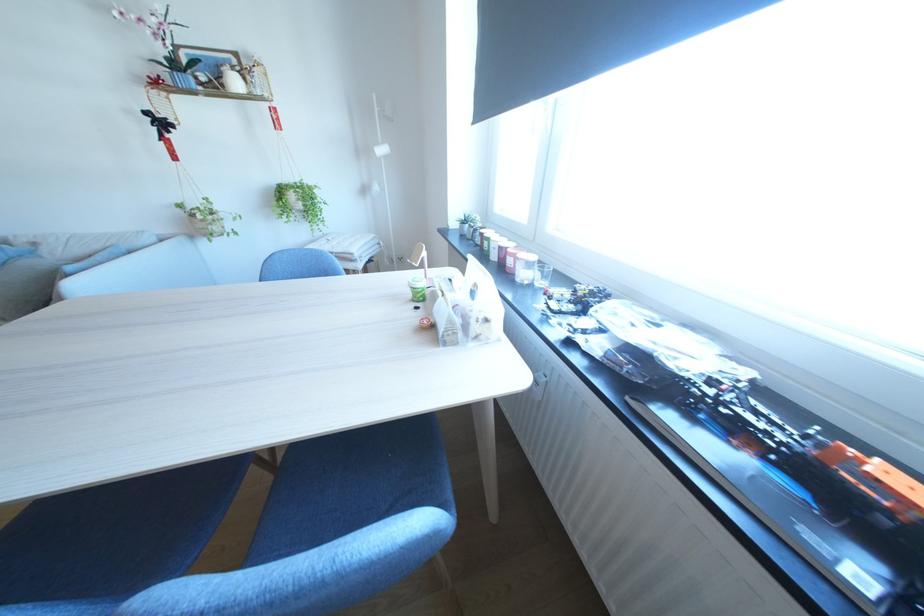
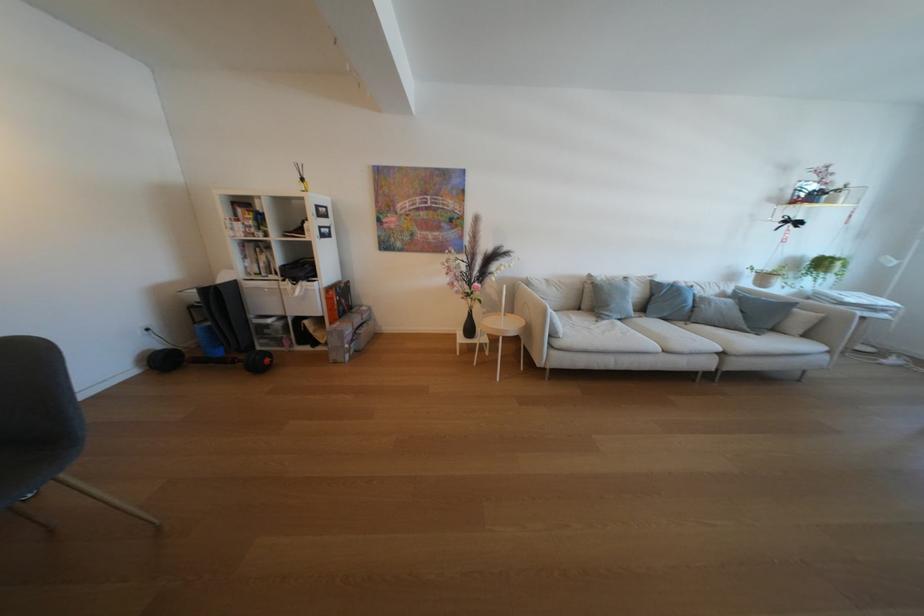
Find the pixel in the second image that matches [117,243] in the first image.

(730, 289)